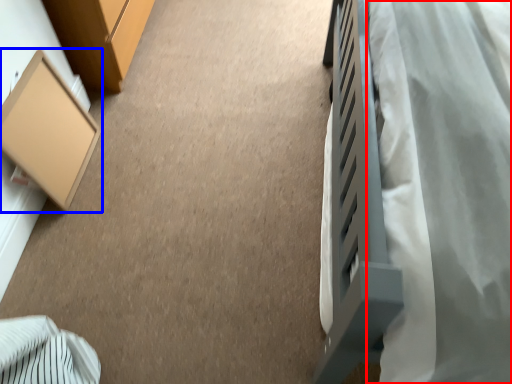
Question: Which object appears closest to the camera in this image, blanket (highlighted by a red box) or furniture (highlighted by a blue box)?

Choices:
 (A) blanket
 (B) furniture

Answer: (A)